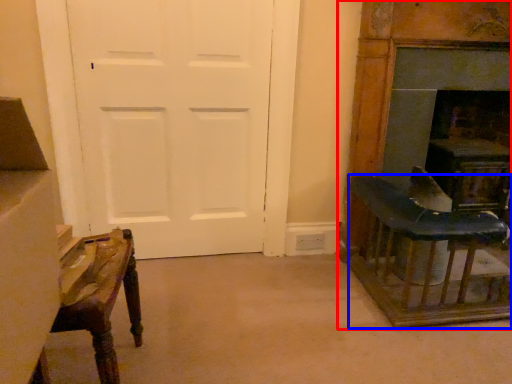
Question: Which object is further to the camera taking this photo, furniture (highlighted by a red box) or table (highlighted by a blue box)?

Choices:
 (A) furniture
 (B) table

Answer: (A)